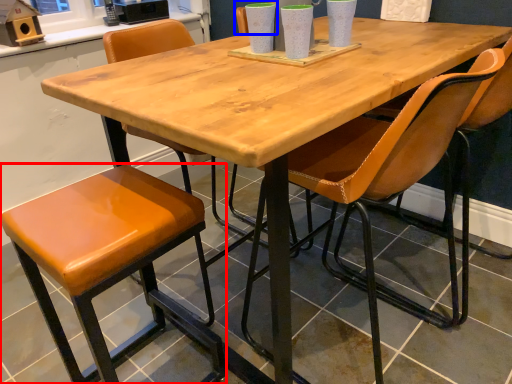
Question: Among these objects, which one is nearest to the camera, stool (highlighted by a red box) or chair (highlighted by a blue box)?

Choices:
 (A) stool
 (B) chair

Answer: (A)